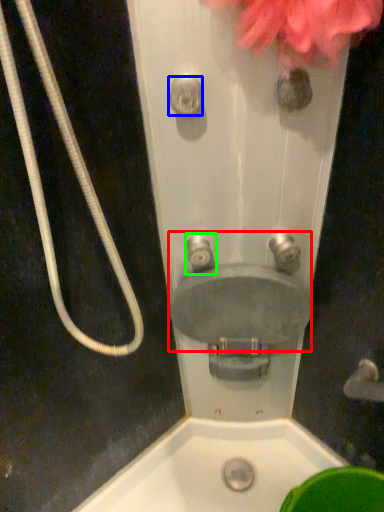
Question: Which is farther away from sink (highlighted by a red box)? shower (highlighted by a blue box) or plumbing fixture (highlighted by a green box)?

Choices:
 (A) shower
 (B) plumbing fixture

Answer: (A)